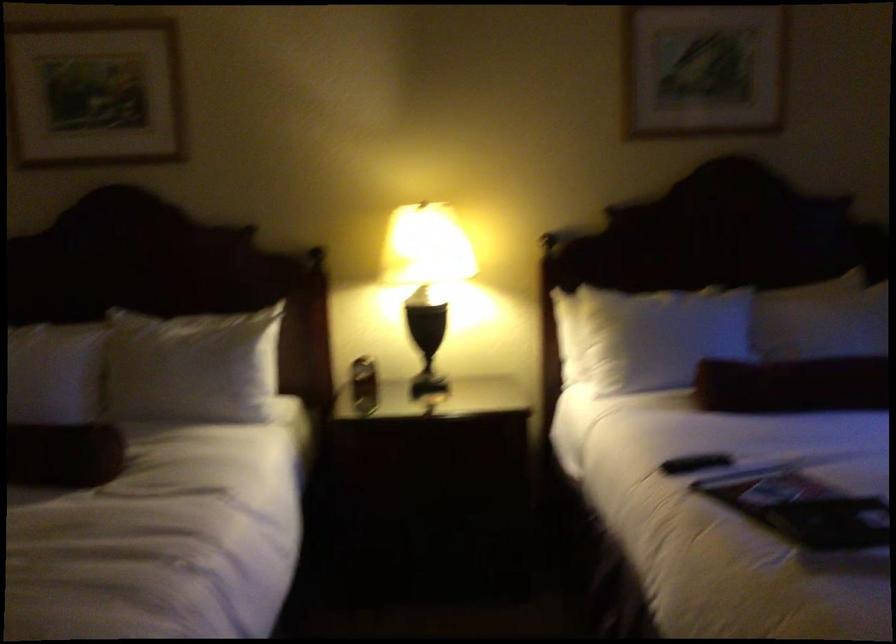
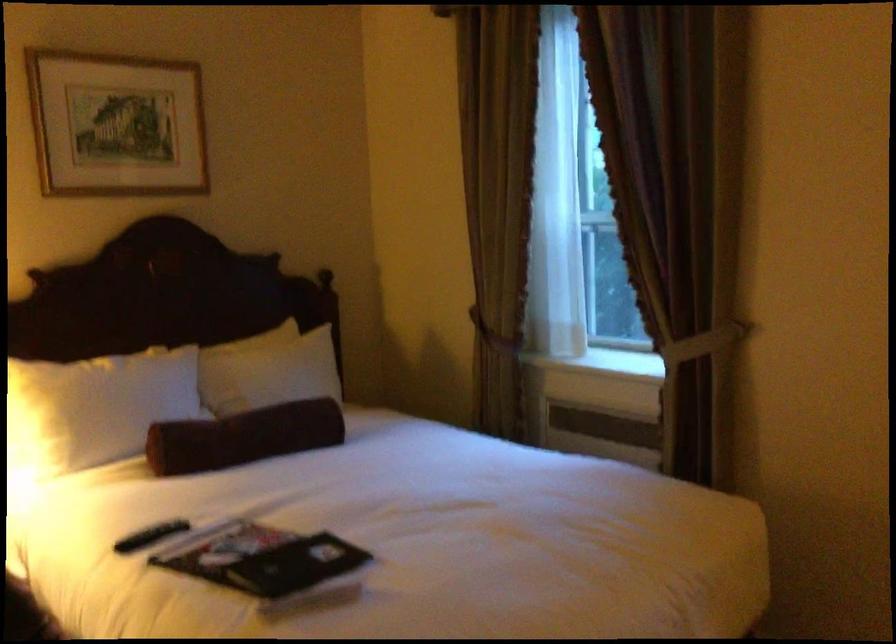
Question: The camera is either moving clockwise (left) or counter-clockwise (right) around the object. The first image is from the beginning of the video and the second image is from the end. Is the camera moving left or right when shooting the video?

Choices:
 (A) Left
 (B) Right

Answer: (A)